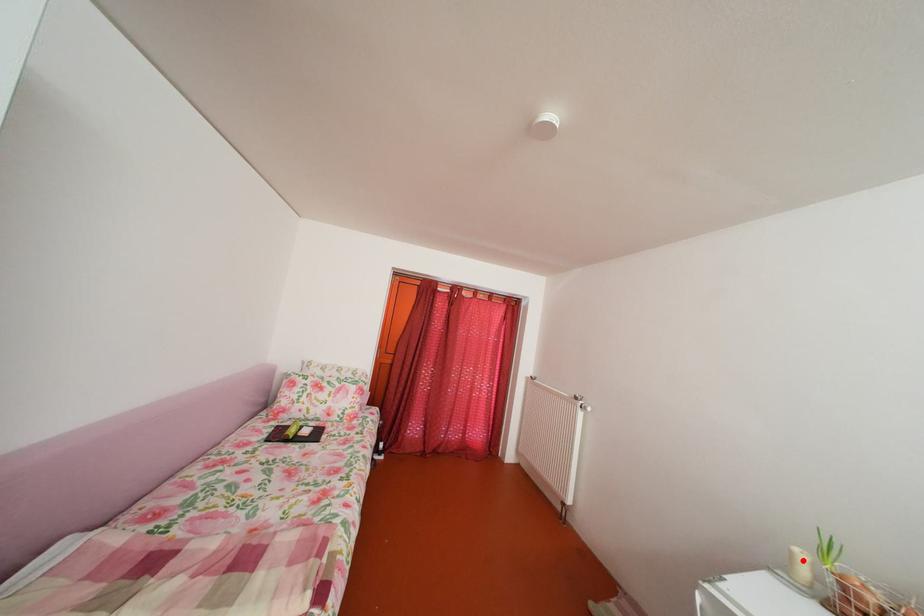
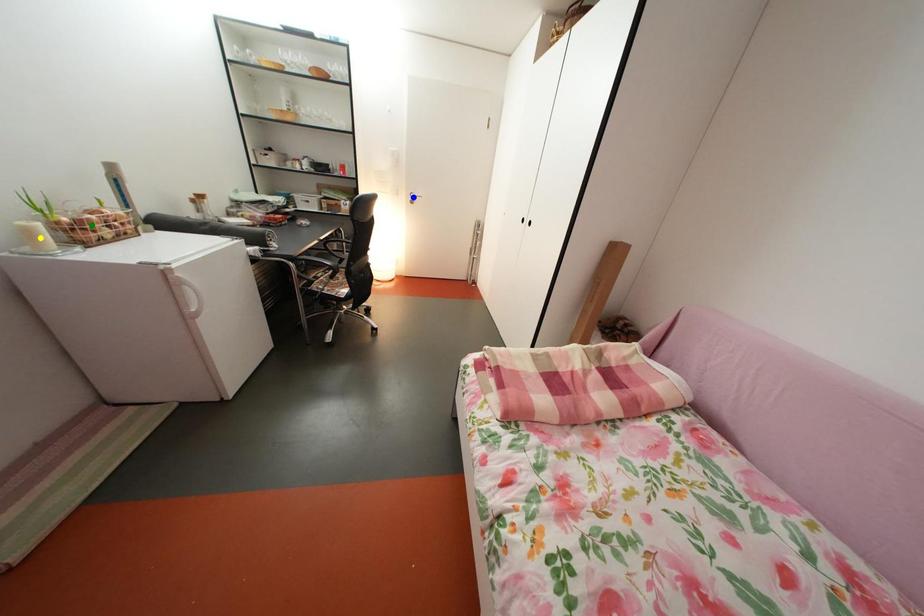
Question: I am providing you with two images of the same scene from different viewpoints. A red point is marked on the first image. You are given multiple points on the second image. Which mark in image 2 goes with the point in image 1?

Choices:
 (A) blue point
 (B) yellow point
 (C) green point

Answer: (B)